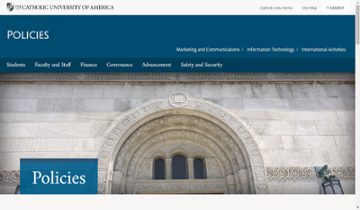
Find the location of a particular element. This screenshot has height=210, width=360. light is located at coordinates (324, 180).